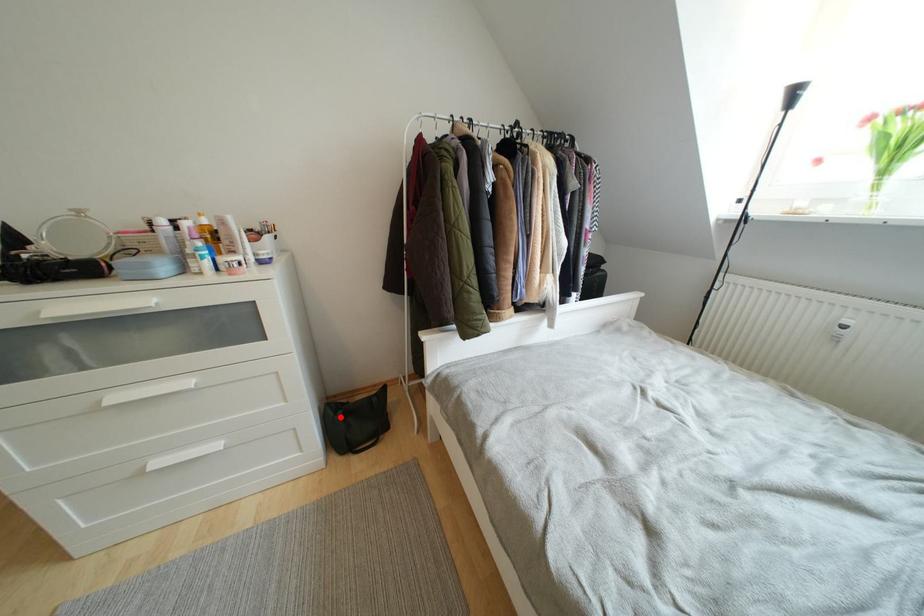
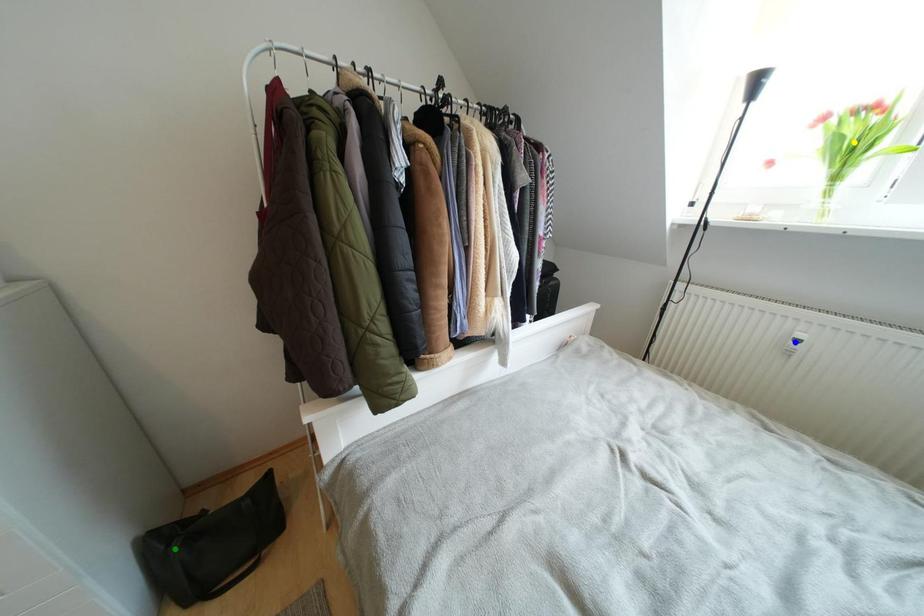
Question: I am providing you with two images of the same scene from different viewpoints. A red point is marked on the first image. You are given multiple points on the second image. Can you choose the point in image 2 that corresponds to the point in image 1?

Choices:
 (A) green point
 (B) yellow point
 (C) blue point

Answer: (A)